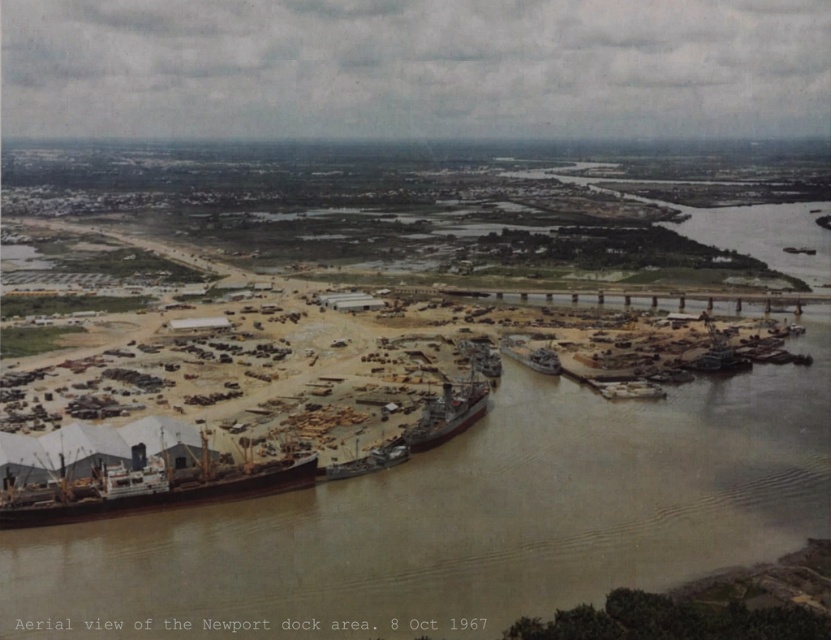
Question: Which object appears closest to the camera in this image?

Choices:
 (A) dark gray metallic ship at center
 (B) brown muddy water at center
 (C) brown wooden boat at lower left

Answer: (B)

Question: Is dark gray metallic ship at center positioned in front of wooden planks boat at lower right?

Choices:
 (A) no
 (B) yes

Answer: (B)

Question: Estimate the real-world distances between objects in this image. Which object is closer to the brown wooden boat at lower left?

Choices:
 (A) brown muddy water at center
 (B) brown wooden ship at center

Answer: (B)

Question: Can you confirm if brown wooden ship at center is bigger than rustic wooden boat at lower right?

Choices:
 (A) no
 (B) yes

Answer: (B)

Question: Is dark gray metallic ship at center below brown wooden ship at center?

Choices:
 (A) yes
 (B) no

Answer: (B)

Question: Which object is the closest to the brown wooden ship at center?

Choices:
 (A) brown muddy water at center
 (B) dark gray metallic ship at center
 (C) rustic wooden boat at lower right

Answer: (B)